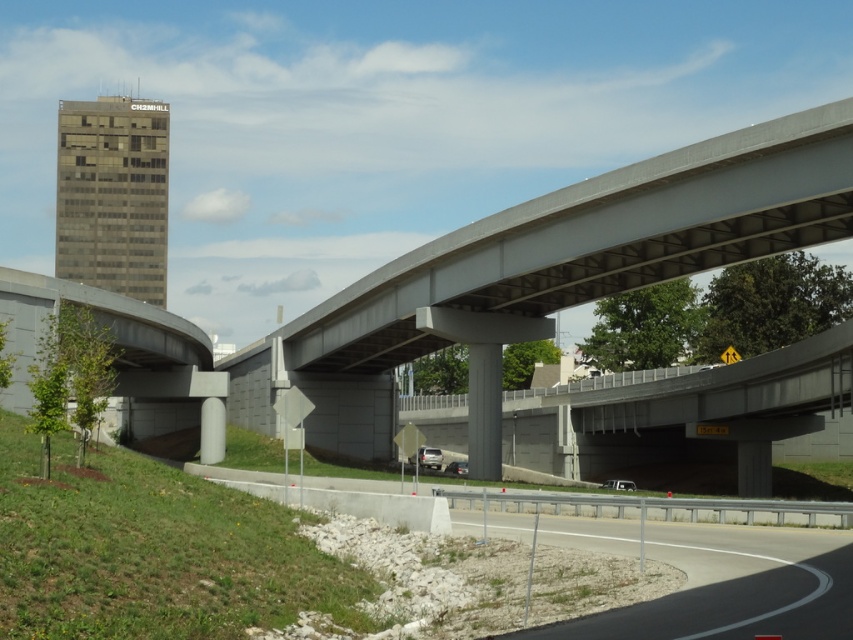
Question: Does satin silver sedan at center have a lesser width compared to metallic silver sedan at center?

Choices:
 (A) yes
 (B) no

Answer: (B)

Question: Is gray concrete pillar at center thinner than metallic silver sedan at center?

Choices:
 (A) yes
 (B) no

Answer: (A)

Question: Which object appears farthest from the camera in this image?

Choices:
 (A) gray asphalt highway at lower right
 (B) satin silver sedan at center
 (C) dark gray glass building at upper left

Answer: (C)

Question: Which point appears closest to the camera in this image?

Choices:
 (A) (419, 456)
 (B) (778, 131)
 (C) (476, 436)

Answer: (B)

Question: Which point is closer to the camera?

Choices:
 (A) gray asphalt highway at lower right
 (B) metallic silver sedan at center
 (C) satin silver sedan at center

Answer: (A)

Question: Can you confirm if dark gray glass building at upper left is bigger than gray concrete pillar at center?

Choices:
 (A) no
 (B) yes

Answer: (B)